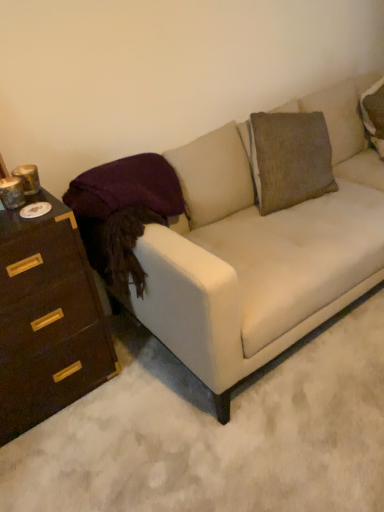
Question: In the image, is dark brown wood chest of drawers at left positioned in front of or behind white fabric couch at center?

Choices:
 (A) behind
 (B) front

Answer: (A)

Question: Is dark brown wood chest of drawers at left bigger or smaller than white fabric couch at center?

Choices:
 (A) small
 (B) big

Answer: (A)

Question: Choose the correct answer: Is dark brown wood chest of drawers at left inside white fabric couch at center or outside it?

Choices:
 (A) outside
 (B) inside

Answer: (A)

Question: Considering the positions of white fabric couch at center and dark brown wood chest of drawers at left in the image, is white fabric couch at center bigger or smaller than dark brown wood chest of drawers at left?

Choices:
 (A) big
 (B) small

Answer: (A)

Question: From a real-world perspective, is white fabric couch at center above or below dark brown wood chest of drawers at left?

Choices:
 (A) above
 (B) below

Answer: (A)

Question: Relative to dark brown wood chest of drawers at left, is white fabric couch at center in front or behind?

Choices:
 (A) behind
 (B) front

Answer: (B)

Question: Is white fabric couch at center spatially inside dark brown wood chest of drawers at left, or outside of it?

Choices:
 (A) outside
 (B) inside

Answer: (A)